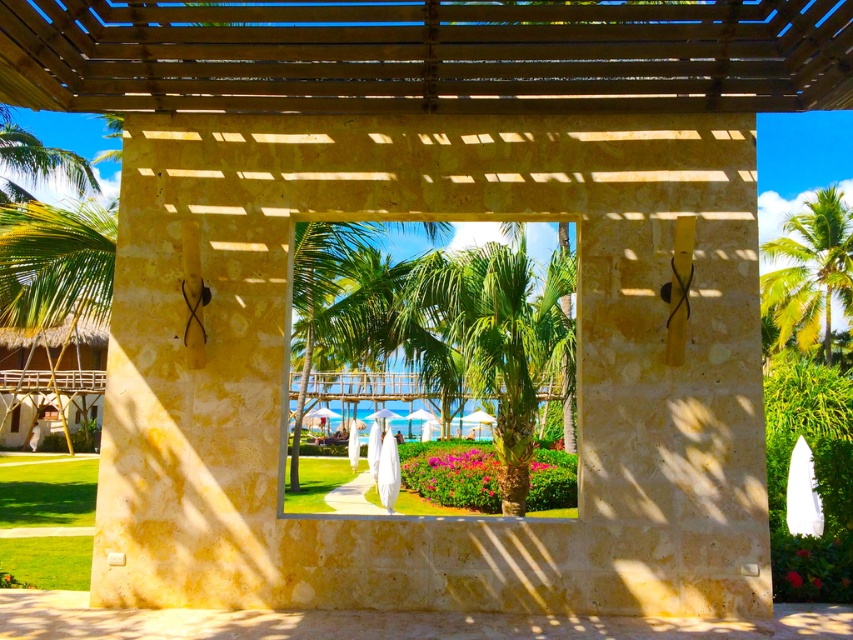
Question: Is green leafy palm tree at center thinner than green leafy palm tree at upper right?

Choices:
 (A) yes
 (B) no

Answer: (A)

Question: Is green leafy palm tree at center above green leafy palm tree at upper right?

Choices:
 (A) no
 (B) yes

Answer: (A)

Question: Does green leafy palm tree at center appear under green leafy palm tree at upper right?

Choices:
 (A) no
 (B) yes

Answer: (B)

Question: Among these objects, which one is farthest from the camera?

Choices:
 (A) green leafy palm tree at center
 (B) green leafy palm tree at upper right

Answer: (B)